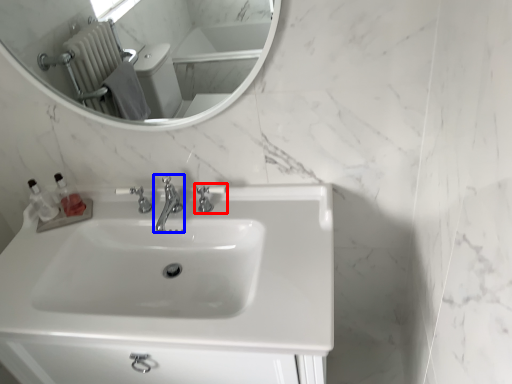
Question: Which of the following is the closest to the observer, tap (highlighted by a red box) or tap (highlighted by a blue box)?

Choices:
 (A) tap
 (B) tap

Answer: (B)